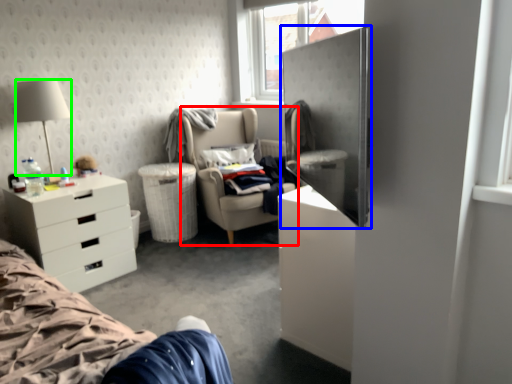
Question: Which object is positioned closest to chair (highlighted by a red box)? Select from armoire (highlighted by a blue box) and lamp (highlighted by a green box).

Choices:
 (A) armoire
 (B) lamp

Answer: (B)